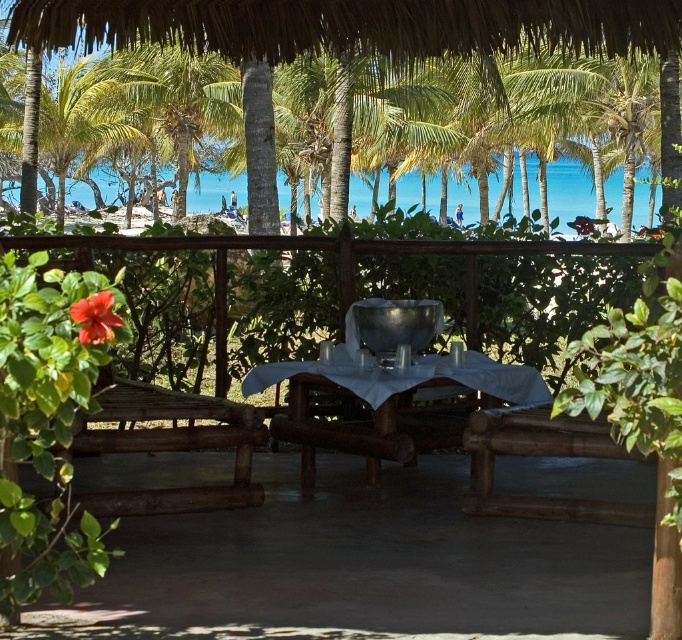
You are setting up a table for a beachside event and need to ensure the metallic silver bowl at center and the red matte flower at upper left fit within the tablecloth. Given the tablecloth is 1.2 meters wide, can both items be placed without exceeding the tablecloth width?

The metallic silver bowl at center has a larger width than the red matte flower at upper left. Since the tablecloth is 1.2 meters wide, both items can fit as long as their combined widths do not exceed the tablecloth width. However, without knowing the exact widths of each item, it is impossible to confirm definitively.